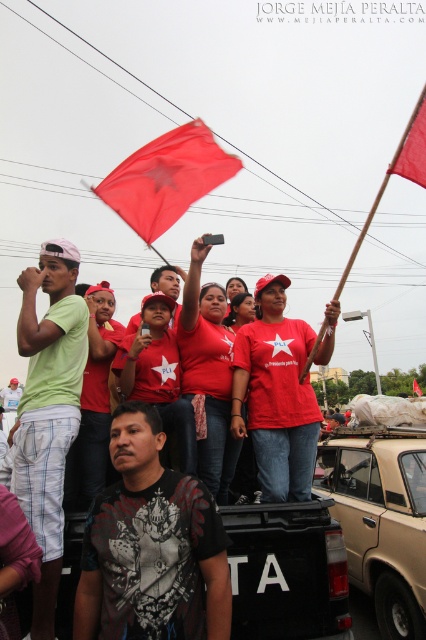
Question: Is dark gray printed shirt at center bigger than red matte shirt at center?

Choices:
 (A) yes
 (B) no

Answer: (B)

Question: Is tan matte car at lower right wider than red fabric flag at upper right?

Choices:
 (A) no
 (B) yes

Answer: (A)

Question: Among these points, which one is nearest to the camera?

Choices:
 (A) (184, 532)
 (B) (423, 172)
 (C) (281, 317)

Answer: (A)

Question: Is red matte flag at upper center in front of red fabric flag at upper right?

Choices:
 (A) yes
 (B) no

Answer: (B)

Question: Considering the real-world distances, which object is farthest from the tan matte car at lower right?

Choices:
 (A) red matte flag at upper center
 (B) red matte shirt at center

Answer: (A)

Question: Which point is farther from the camera taking this photo?

Choices:
 (A) (420, 125)
 (B) (235, 339)
 (C) (147, 173)

Answer: (C)